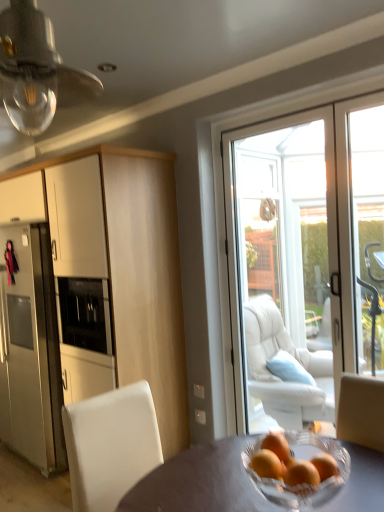
Describe the element at coordinates (276, 444) in the screenshot. I see `orange matte at center` at that location.

Describe the element at coordinates (36, 70) in the screenshot. I see `clear glass bulb at upper left` at that location.

The height and width of the screenshot is (512, 384). What do you see at coordinates (368, 233) in the screenshot?
I see `transparent glass door at right` at bounding box center [368, 233].

Identify the location of matte gray table at center. The image size is (384, 512). (199, 482).

Locate an element on the screen. orange matte at center is located at coordinates (x=276, y=444).

Considering the sizes of objects white leather chair at lower left and white glass door at center in the image provided, who is bigger, white leather chair at lower left or white glass door at center?

white leather chair at lower left is bigger.

Could you tell me if white leather chair at lower left is facing white glass door at center?

No, white leather chair at lower left does not turn towards white glass door at center.

In terms of height, does white leather chair at lower left look taller or shorter compared to white glass door at center?

white leather chair at lower left is shorter than white glass door at center.

Is white leather chair at lower left next to white glass door at center?

white leather chair at lower left is not next to white glass door at center, and they're not touching.

Which is farther from the camera, (273, 432) or (93, 411)?

The point (273, 432) is behind.

You are a GUI agent. You are given a task and a screenshot of the screen. Output one action in this format:
    pyautogui.click(x=<x>, y=<y>)
    Task: Click on the chair on the left side of orange matte at center
    The width and height of the screenshot is (384, 512).
    Given the screenshot: What is the action you would take?
    pyautogui.click(x=110, y=445)

Is orange matte at center facing towards white leather chair at lower left?

No, orange matte at center is not turned towards white leather chair at lower left.

Can you confirm if transparent glass door at right is taller than clear glass bulb at upper left?

Yes, transparent glass door at right is taller than clear glass bulb at upper left.

From the image's perspective, is transparent glass door at right above or below clear glass bulb at upper left?

From the image's perspective, transparent glass door at right appears below clear glass bulb at upper left.

Is transparent glass door at right wider than clear glass bulb at upper left?

No, transparent glass door at right is not wider than clear glass bulb at upper left.

Choose the correct answer: Is transparent glass door at right inside clear glass bulb at upper left or outside it?

transparent glass door at right is spatially situated outside clear glass bulb at upper left.

Image resolution: width=384 pixels, height=512 pixels. I want to click on light fixture located on the left of transparent glass door at right, so click(x=36, y=70).

Is transparent glass door at right a part of clear glass bulb at upper left?

No, transparent glass door at right is not inside clear glass bulb at upper left.

Is clear glass bulb at upper left oriented towards transparent glass door at right?

No, clear glass bulb at upper left is not facing towards transparent glass door at right.

From a real-world perspective, who is located higher, clear glass bulb at upper left or transparent glass door at right?

clear glass bulb at upper left is physically above.

Does white leather chair at lower left have a smaller size compared to clear glass bulb at upper left?

No, white leather chair at lower left is not smaller than clear glass bulb at upper left.

Consider the image. Is clear glass bulb at upper left at the back of white leather chair at lower left?

No.

From a real-world perspective, does white leather chair at lower left sit lower than clear glass bulb at upper left?

Yes, from a real-world perspective, white leather chair at lower left is under clear glass bulb at upper left.

You are a GUI agent. You are given a task and a screenshot of the screen. Output one action in this format:
    pyautogui.click(x=<x>, y=<y>)
    Task: Click on the door above the white leather chair at lower left (from the image's perspective)
    
    Given the screenshot: What is the action you would take?
    pyautogui.click(x=303, y=253)

Is white glass door at center with white leather chair at lower left?

white glass door at center and white leather chair at lower left are clearly separated.

Can you tell me how much white glass door at center and white leather chair at lower left differ in facing direction?

The angle between the facing direction of white glass door at center and the facing direction of white leather chair at lower left is 84.5 degrees.

From a real-world perspective, is white glass door at center physically below white leather chair at lower left?

No, from a real-world perspective, white glass door at center is not under white leather chair at lower left.

Is white glass door at center with matte white cabinet at left?

They are not placed beside each other.

Is matte white cabinet at left inside white glass door at center?

No, white glass door at center does not contain matte white cabinet at left.

From a real-world perspective, is white glass door at center physically below matte white cabinet at left?

Actually, white glass door at center is physically above matte white cabinet at left in the real world.

Identify the location of chair below the white glass door at center (from the image's perspective). This screenshot has height=512, width=384. (110, 445).

I want to click on chair located on the left of orange matte at center, so click(x=110, y=445).

Which object lies further to the anchor point clear glass bulb at upper left, white leather chair at lower left or matte white cabinet at left?

white leather chair at lower left.

When comparing their distances from matte white cabinet at left, does white leather chair at lower left or clear glass bulb at upper left seem closer?

The object closer to matte white cabinet at left is white leather chair at lower left.

When comparing their distances from clear glass bulb at upper left, does matte white cabinet at left or transparent glass door at right seem closer?

Among the two, matte white cabinet at left is located nearer to clear glass bulb at upper left.

When comparing their distances from white leather chair at lower left, does matte gray table at center or white glass door at center seem further?

white glass door at center is further to white leather chair at lower left.

Looking at this image, considering their positions, is white glass door at center positioned closer to white leather chair at lower left than orange matte at center?

orange matte at center is closer to white leather chair at lower left.

Which object lies further to the anchor point white leather chair at lower left, clear glass bulb at upper left or white glass door at center?

clear glass bulb at upper left lies further to white leather chair at lower left than the other object.

Estimate the real-world distances between objects in this image. Which object is closer to white leather chair at lower left, matte white cabinet at left or transparent glass door at right?

matte white cabinet at left is closer to white leather chair at lower left.

Looking at the image, which one is located further to matte gray table at center, clear glass bulb at upper left or transparent glass door at right?

transparent glass door at right is positioned further to the anchor matte gray table at center.

Find the location of a particular element. This screenshot has height=512, width=384. orange between clear glass bulb at upper left and matte gray table at center from top to bottom is located at coordinates (276, 444).

The image size is (384, 512). Identify the location of door between matte white cabinet at left and transparent glass door at right. (303, 253).

Identify the location of chair between matte gray table at center and transparent glass door at right along the z-axis. (110, 445).

At what (x,y) coordinates should I click in order to perform the action: click on orange positioned between matte gray table at center and white glass door at center from near to far. Please return your answer as a coordinate pair (x, y). The image size is (384, 512). Looking at the image, I should click on (276, 444).